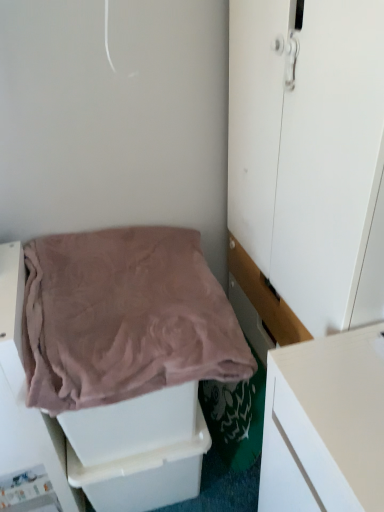
Question: Does white matte door at center touch pink soft fabric at lower left?

Choices:
 (A) yes
 (B) no

Answer: (B)

Question: Is white matte door at center thinner than pink soft fabric at lower left?

Choices:
 (A) no
 (B) yes

Answer: (B)

Question: Does white matte door at center have a lesser height compared to pink soft fabric at lower left?

Choices:
 (A) yes
 (B) no

Answer: (B)

Question: From a real-world perspective, does white matte door at center sit lower than pink soft fabric at lower left?

Choices:
 (A) no
 (B) yes

Answer: (B)

Question: Is white matte door at center positioned with its back to pink soft fabric at lower left?

Choices:
 (A) no
 (B) yes

Answer: (B)

Question: From the image's perspective, does white matte door at center appear higher than pink soft fabric at lower left?

Choices:
 (A) yes
 (B) no

Answer: (A)

Question: Is white matte door at center positioned far away from white plastic drawer at lower center?

Choices:
 (A) no
 (B) yes

Answer: (A)

Question: Does white matte door at center have a larger size compared to white plastic drawer at lower center?

Choices:
 (A) no
 (B) yes

Answer: (B)

Question: From the image's perspective, is white matte door at center on top of white plastic drawer at lower center?

Choices:
 (A) yes
 (B) no

Answer: (A)

Question: Considering the relative sizes of white matte door at center and white plastic drawer at lower center in the image provided, is white matte door at center thinner than white plastic drawer at lower center?

Choices:
 (A) yes
 (B) no

Answer: (B)

Question: Is white matte door at center in front of white plastic drawer at lower center?

Choices:
 (A) no
 (B) yes

Answer: (B)

Question: Is white matte door at center looking in the opposite direction of white plastic drawer at lower center?

Choices:
 (A) no
 (B) yes

Answer: (A)

Question: Does white plastic drawer at lower center have a greater height compared to pink soft fabric at lower left?

Choices:
 (A) yes
 (B) no

Answer: (A)